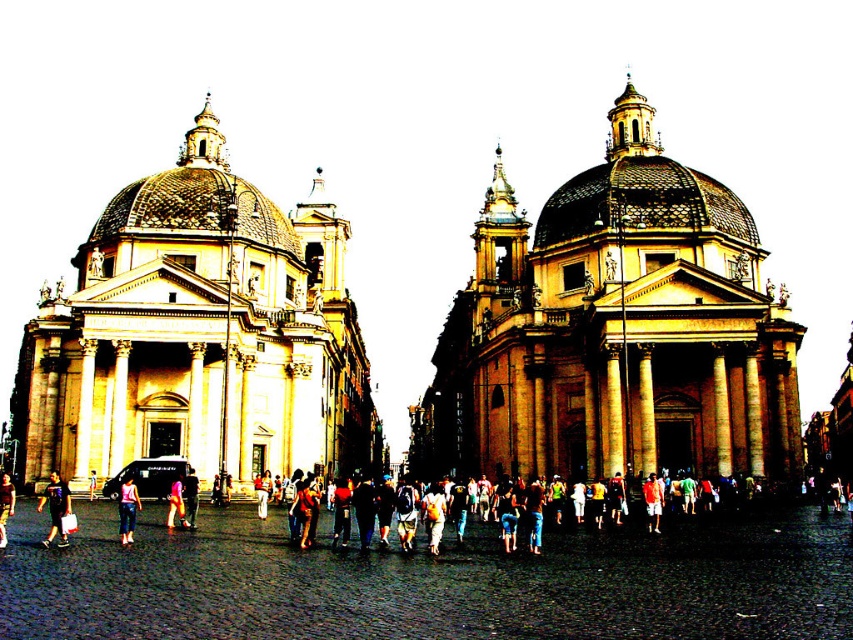
You are an architect visiting the square and want to take a photo of the brown stone church at center and the brown cobblestone plaza at center. Which one should you focus on to capture their full size in the frame?

The brown stone church at center has a larger size compared to the brown cobblestone plaza at center, so you should focus on the brown stone church at center to capture its full size in the frame.

You are a photographer trying to capture the two people in the scene. You want to ensure that the denim pants at lower left and the light pink fabric dress at center are both visible in your shot. Based on their positions, which direction should you move to frame them properly?

The denim pants at lower left is positioned on the left side of light pink fabric dress at center, so moving to the right of the light pink fabric dress at center would allow both subjects to be framed within the shot.

You are standing in the square and see the denim pants at lower left and the light pink fabric dress at center. Which clothing item is positioned higher in the image?

The denim pants at lower left is located above the light pink fabric dress at center in the image.